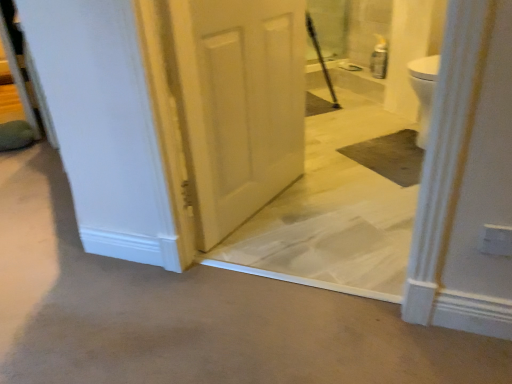
Question: Does white glossy concrete at center have a greater height compared to white matte door at center?

Choices:
 (A) no
 (B) yes

Answer: (A)

Question: From the image's perspective, is white glossy concrete at center above white matte door at center?

Choices:
 (A) yes
 (B) no

Answer: (B)

Question: Considering the relative sizes of white glossy concrete at center and white matte door at center in the image provided, is white glossy concrete at center smaller than white matte door at center?

Choices:
 (A) no
 (B) yes

Answer: (A)

Question: Is white glossy concrete at center far from white matte door at center?

Choices:
 (A) no
 (B) yes

Answer: (A)

Question: Is white glossy concrete at center looking in the opposite direction of white matte door at center?

Choices:
 (A) no
 (B) yes

Answer: (B)

Question: Is white glossy concrete at center in front of white matte door at center?

Choices:
 (A) no
 (B) yes

Answer: (B)

Question: Are white matte door at center and white glossy concrete at center far apart?

Choices:
 (A) yes
 (B) no

Answer: (B)

Question: Considering the relative sizes of white matte door at center and white glossy concrete at center in the image provided, is white matte door at center wider than white glossy concrete at center?

Choices:
 (A) no
 (B) yes

Answer: (A)

Question: Is white matte door at center to the left of white glossy concrete at center from the viewer's perspective?

Choices:
 (A) no
 (B) yes

Answer: (A)

Question: Does white matte door at center lie behind white glossy concrete at center?

Choices:
 (A) yes
 (B) no

Answer: (A)

Question: Considering the relative sizes of white matte door at center and white glossy concrete at center in the image provided, is white matte door at center taller than white glossy concrete at center?

Choices:
 (A) yes
 (B) no

Answer: (A)

Question: From a real-world perspective, does white matte door at center sit lower than white glossy concrete at center?

Choices:
 (A) yes
 (B) no

Answer: (B)

Question: Considering the positions of point (64, 322) and point (294, 69), is point (64, 322) closer or farther from the camera than point (294, 69)?

Choices:
 (A) closer
 (B) farther

Answer: (A)